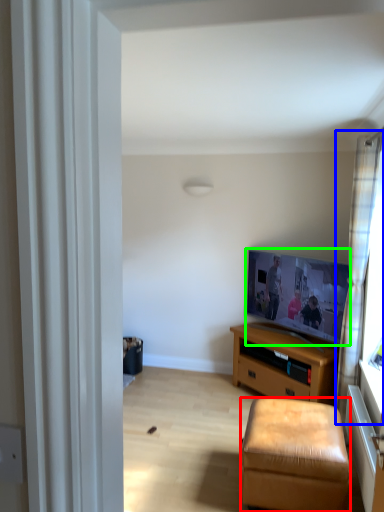
Question: Based on their relative distances, which object is nearer to stool (highlighted by a red box)? Choose from curtain (highlighted by a blue box) and picture frame (highlighted by a green box).

Choices:
 (A) curtain
 (B) picture frame

Answer: (A)